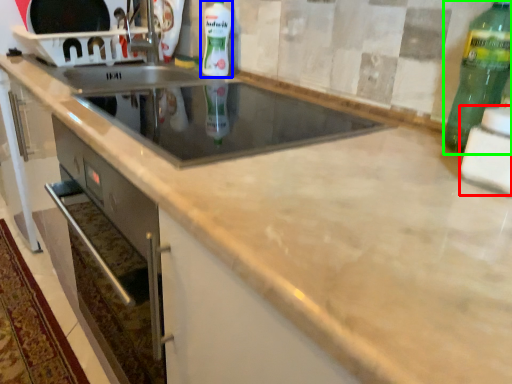
Question: Estimate the real-world distances between objects in this image. Which object is closer to appliance (highlighted by a red box), bottle (highlighted by a blue box) or bottle (highlighted by a green box)?

Choices:
 (A) bottle
 (B) bottle

Answer: (B)